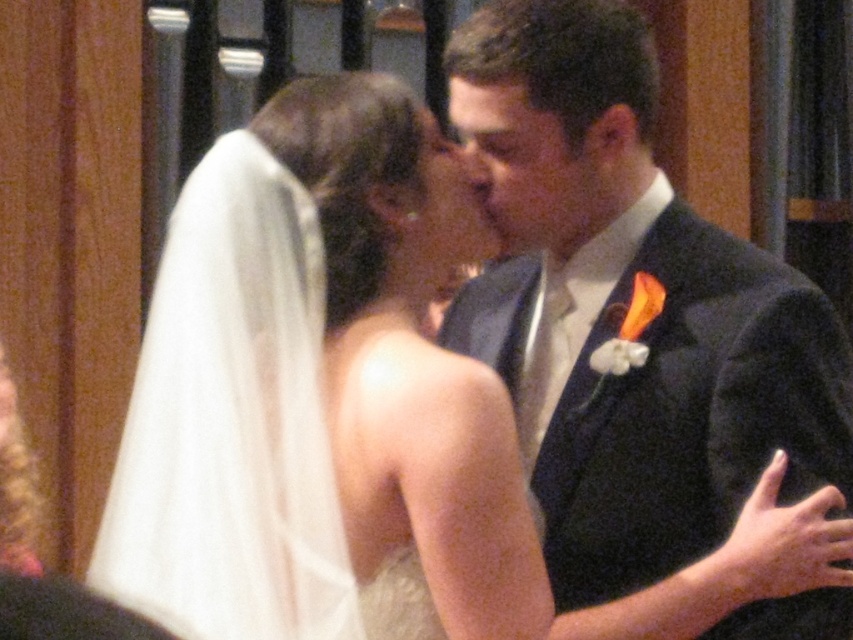
You are standing in front of the wedding photo and want to touch the two points shown in the image. Which point, point (665, 356) or point (471, 112), is closer to you?

Point (665, 356) is closer to the viewer than point (471, 112).

You are a photographer at a wedding. You need to adjust the lighting so that the matte black suit at center and the matte black forehead at center are both well lit. Which object should you focus the light on first to ensure both are properly illuminated?

The matte black forehead at center should be focused on first because it is positioned above the matte black suit at center, so directing light towards the forehead will also illuminate the suit below it.

Looking at this image, you are a photographer at a wedding and need to adjust the lighting to ensure both the matte black suit at center and the matte black forehead at center are well lit. Since matte black surfaces absorb more light, which object requires more light to achieve proper exposure?

The matte black suit at center requires more light because it is wider than the matte black forehead at center, and since wider matte black surfaces absorb more light, it needs additional illumination to match exposure levels.